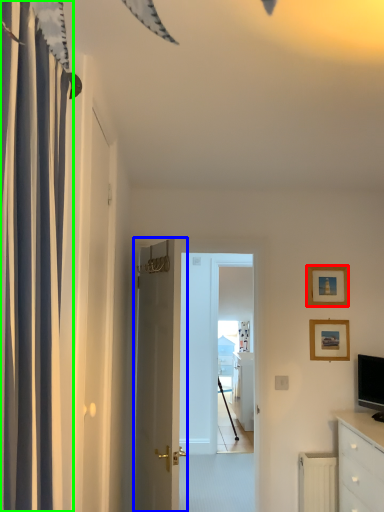
Question: Which is nearer to the picture frame (highlighted by a red box)? door (highlighted by a blue box) or curtain (highlighted by a green box).

Choices:
 (A) door
 (B) curtain

Answer: (A)